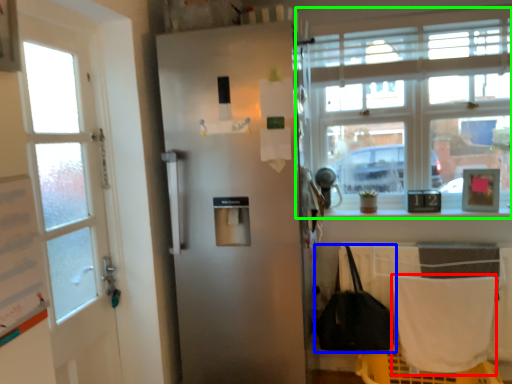
Question: Which object is the farthest from blanket (highlighted by a red box)? Choose among these: handbag (highlighted by a blue box) or window (highlighted by a green box).

Choices:
 (A) handbag
 (B) window

Answer: (B)